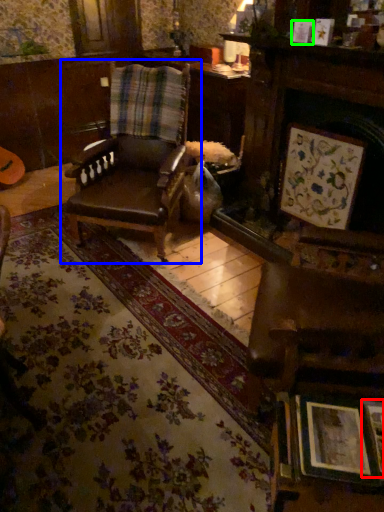
Question: Based on their relative distances, which object is nearer to picture frame (highlighted by a red box)? Choose from chair (highlighted by a blue box) and picture frame (highlighted by a green box).

Choices:
 (A) chair
 (B) picture frame

Answer: (B)